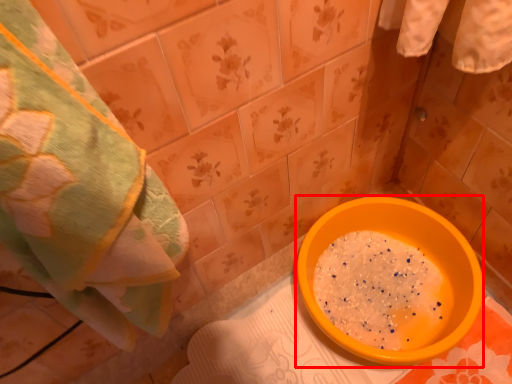
Question: From the image's perspective, what is the correct spatial relationship of basin (annotated by the red box) in relation to towel?

Choices:
 (A) below
 (B) above

Answer: (A)